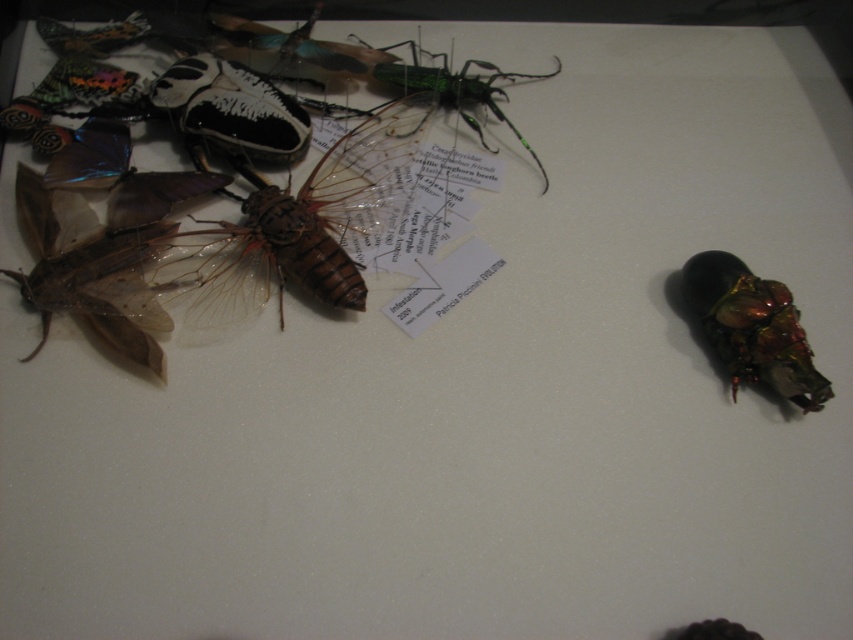
Does brown translucent wing at center appear under metallic iridescent beetle at right?

No.

What do you see at coordinates (300, 225) in the screenshot?
I see `brown translucent wing at center` at bounding box center [300, 225].

Who is more forward, (378, 157) or (727, 314)?

Point (727, 314) is in front.

The image size is (853, 640). Identify the location of brown translucent wing at center. (300, 225).

Is brown translucent wings at left wider than metallic iridescent beetle at right?

Yes.

Does brown translucent wings at left appear under metallic iridescent beetle at right?

Incorrect, brown translucent wings at left is not positioned below metallic iridescent beetle at right.

Is point (105, 273) closer to camera compared to point (785, 362)?

No.

You are a GUI agent. You are given a task and a screenshot of the screen. Output one action in this format:
    pyautogui.click(x=<x>, y=<y>)
    Task: Click on the brown translucent wings at left
    
    Given the screenshot: What is the action you would take?
    pyautogui.click(x=91, y=269)

Describe the element at coordinates (300, 225) in the screenshot. The height and width of the screenshot is (640, 853). I see `brown translucent wing at center` at that location.

Which is behind, point (310, 212) or point (165, 234)?

The point (165, 234) is behind.

Locate an element on the screen. This screenshot has width=853, height=640. brown translucent wing at center is located at coordinates (300, 225).